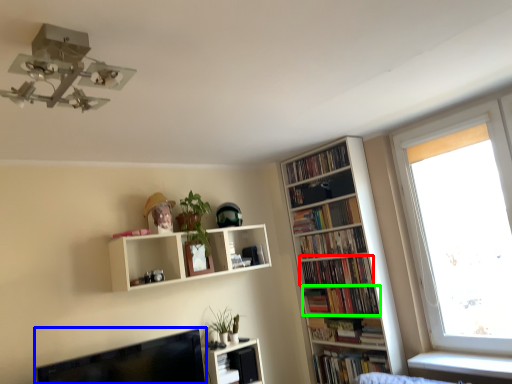
Question: Estimate the real-world distances between objects in this image. Which object is closer to book (highlighted by a red box), computer monitor (highlighted by a blue box) or book (highlighted by a green box)?

Choices:
 (A) computer monitor
 (B) book

Answer: (B)